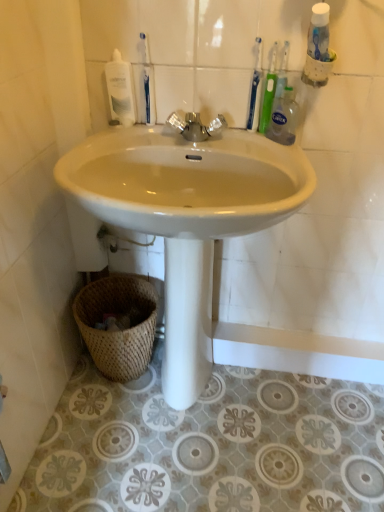
Question: Should I look upward or downward to see white glossy mouthwash at upper left?

Choices:
 (A) up
 (B) down

Answer: (A)

Question: From the image's perspective, is white glossy sink at center over silver metallic faucet at center?

Choices:
 (A) no
 (B) yes

Answer: (A)

Question: Does white glossy sink at center come behind silver metallic faucet at center?

Choices:
 (A) yes
 (B) no

Answer: (B)

Question: Is white glossy sink at center positioned with its back to silver metallic faucet at center?

Choices:
 (A) no
 (B) yes

Answer: (A)

Question: Is white glossy sink at center not inside silver metallic faucet at center?

Choices:
 (A) no
 (B) yes

Answer: (B)

Question: Is white glossy sink at center far away from silver metallic faucet at center?

Choices:
 (A) yes
 (B) no

Answer: (B)

Question: Can you confirm if white glossy sink at center is shorter than silver metallic faucet at center?

Choices:
 (A) no
 (B) yes

Answer: (A)

Question: Is white glossy sink at center oriented away from green plastic toothbrush at upper right, which is the 3th toothbrush from left to right?

Choices:
 (A) yes
 (B) no

Answer: (B)

Question: Considering the relative sizes of white glossy sink at center and green plastic toothbrush at upper right, the 1th toothbrush when ordered from right to left, in the image provided, is white glossy sink at center thinner than green plastic toothbrush at upper right, the 1th toothbrush when ordered from right to left,?

Choices:
 (A) no
 (B) yes

Answer: (A)

Question: Is white glossy sink at center beside green plastic toothbrush at upper right, which is the 3th toothbrush from left to right?

Choices:
 (A) yes
 (B) no

Answer: (B)

Question: From the image's perspective, would you say white glossy sink at center is shown under green plastic toothbrush at upper right, the 1th toothbrush when ordered from right to left?

Choices:
 (A) no
 (B) yes

Answer: (B)

Question: From a real-world perspective, is white glossy sink at center over green plastic toothbrush at upper right, which is the 3th toothbrush from left to right?

Choices:
 (A) yes
 (B) no

Answer: (B)

Question: From a real-world perspective, is white glossy sink at center below green plastic toothbrush at upper right, the 1th toothbrush when ordered from right to left?

Choices:
 (A) yes
 (B) no

Answer: (A)

Question: From a real-world perspective, is blue plastic toothbrush at upper center, which appears as the third toothbrush when viewed from the right, under silver metallic faucet at center?

Choices:
 (A) yes
 (B) no

Answer: (B)